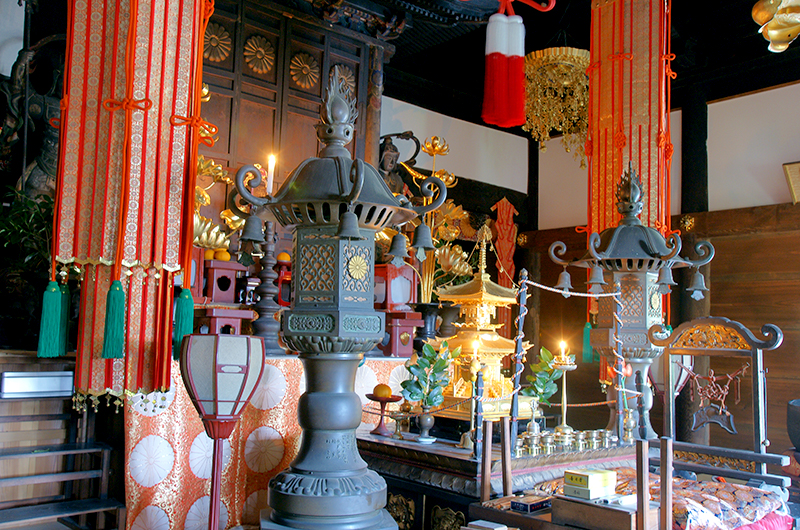
You are a GUI agent. You are given a task and a screenshot of the screen. Output one action in this format:
    pyautogui.click(x=<x>, y=<y>)
    Task: Click on the lantern
    This screenshot has width=800, height=530.
    Given the screenshot: What is the action you would take?
    pyautogui.click(x=344, y=266), pyautogui.click(x=238, y=360), pyautogui.click(x=633, y=292), pyautogui.click(x=705, y=352)